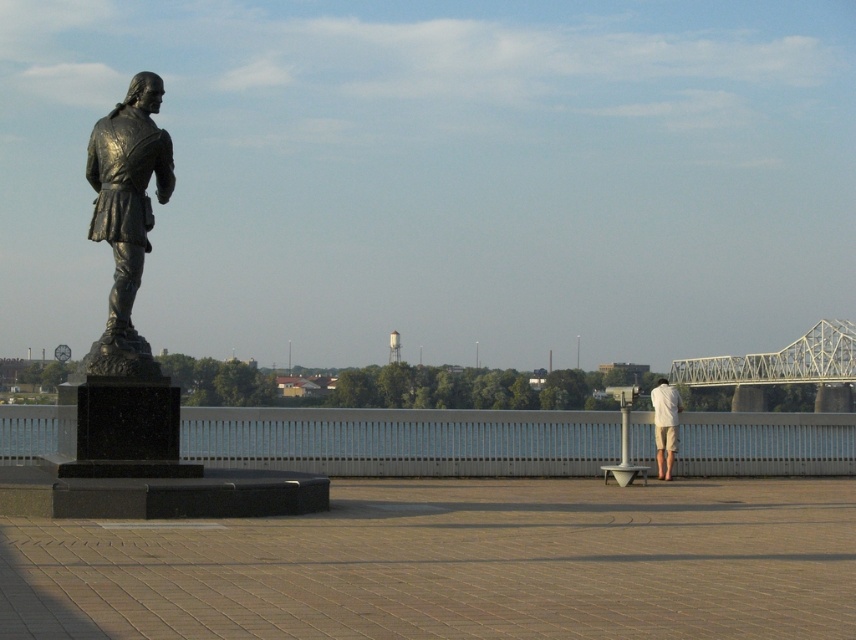
In the scene shown: You are a tour guide explaining the layout of this historical site. Where exactly is the bronze statue at left located in the scene?

Result: The bronze statue at left is located at point (126, 216) in the scene.

You are a tourist standing at the base of the bronze statue at left and want to cross to the white metallic bridge at right. Is the bridge directly behind the statue or behind you?

The bronze statue at left is in front of the white metallic bridge at right, so the bridge is behind the statue from your perspective.

In the scene shown: You are a tourist visiting this scenic spot and want to take a photo of the white metallic bridge at right from the position of the person with the white cotton shorts at right. Can you see the entire bridge in your viewfinder without moving your position?

The white metallic bridge at right is below white cotton shorts at right, so the tourist can see the entire bridge in their viewfinder without moving since the bridge is positioned lower than the shorts, which are at the same horizontal level.